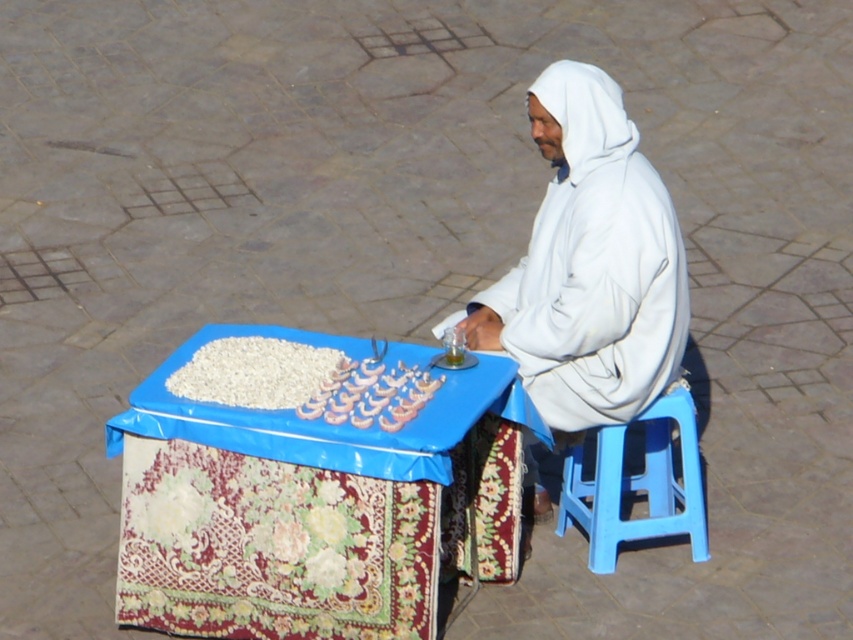
Image resolution: width=853 pixels, height=640 pixels. Describe the element at coordinates (589, 264) in the screenshot. I see `white matte hoodie at center` at that location.

Between point (509, 342) and point (195, 380), which one is positioned in front?

Point (195, 380)

At what (x,y) coordinates should I click in order to perform the action: click on white matte hoodie at center. Please return your answer as a coordinate pair (x, y). Looking at the image, I should click on (589, 264).

Between blue plastic stool at lower right and white matte grains at center, which one has more height?

With more height is blue plastic stool at lower right.

Does blue plastic stool at lower right have a lesser width compared to white matte grains at center?

Correct, blue plastic stool at lower right's width is less than white matte grains at center's.

Find the location of a particular element. This screenshot has width=853, height=640. blue plastic stool at lower right is located at coordinates (637, 484).

This screenshot has height=640, width=853. Describe the element at coordinates (637, 484) in the screenshot. I see `blue plastic stool at lower right` at that location.

I want to click on blue plastic stool at lower right, so click(637, 484).

The width and height of the screenshot is (853, 640). I want to click on blue plastic stool at lower right, so click(637, 484).